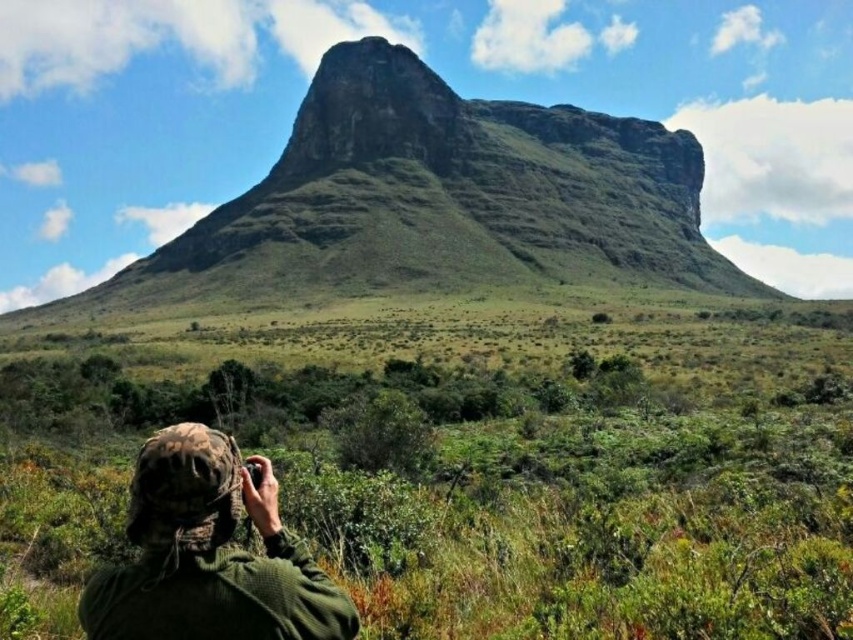
Question: Which is nearer to the camo fabric hat at lower left?

Choices:
 (A) green grassy mountain at center
 (B) green grass at center

Answer: (B)

Question: Is green grass at center to the right of green grassy mountain at center from the viewer's perspective?

Choices:
 (A) yes
 (B) no

Answer: (B)

Question: Which of the following is the closest to the observer?

Choices:
 (A) green grassy mountain at center
 (B) camo fabric hat at lower left

Answer: (B)

Question: Considering the relative positions of green grass at center and green grassy mountain at center in the image provided, where is green grass at center located with respect to green grassy mountain at center?

Choices:
 (A) left
 (B) right

Answer: (A)

Question: Is the position of green grass at center less distant than that of camo fabric hat at lower left?

Choices:
 (A) no
 (B) yes

Answer: (A)

Question: Which of the following is the closest to the observer?

Choices:
 (A) (480, 416)
 (B) (302, 634)

Answer: (B)